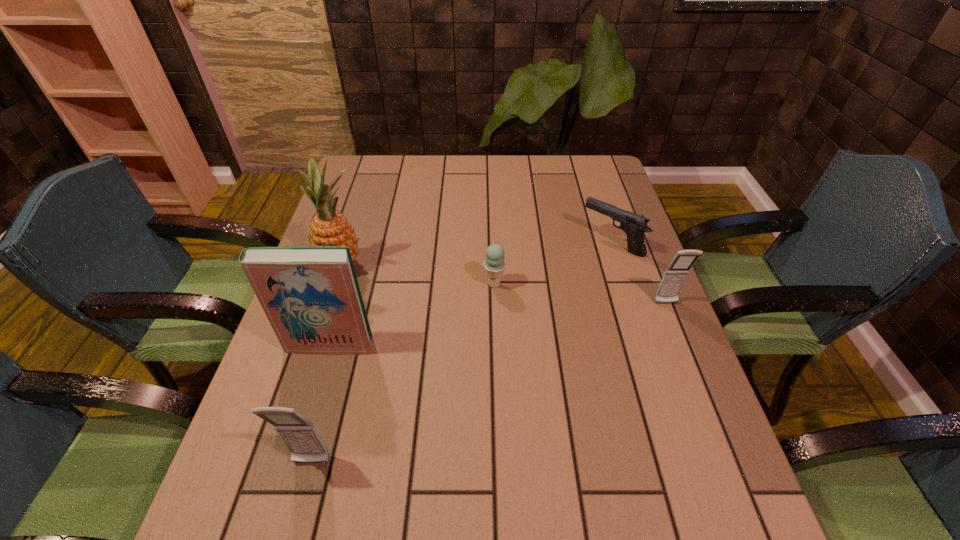
In order to click on the fourth shortest object in this screenshot , I will do `click(300, 435)`.

I want to click on the nearest object, so click(300, 435).

The image size is (960, 540). Find the location of `the third shortest object`. the third shortest object is located at coordinates (675, 275).

The height and width of the screenshot is (540, 960). In order to click on the fourth farthest object in this screenshot , I will do `click(675, 275)`.

Image resolution: width=960 pixels, height=540 pixels. Identify the location of ice cream. (494, 264).

Identify the location of gun. (634, 225).

I want to click on pineapple, so click(x=328, y=227).

Where is `hardback book`? This screenshot has height=540, width=960. hardback book is located at coordinates tap(310, 294).

Where is `the fifth shortest object`? the fifth shortest object is located at coordinates (310, 294).

Find the location of a particular element. vacant space situated on the front-facing side of the fourth tallest object is located at coordinates (688, 362).